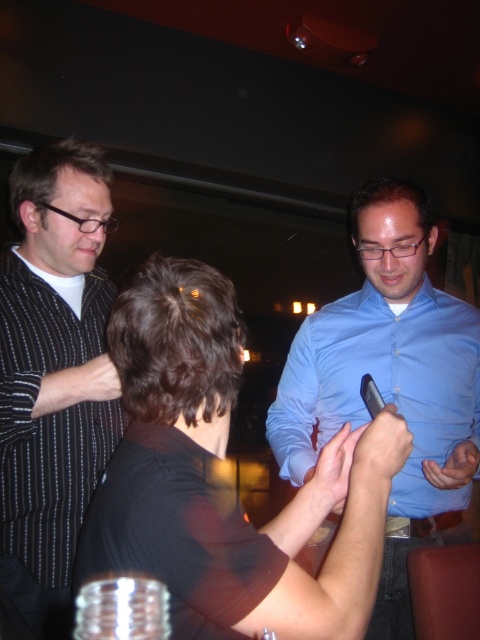
Looking at this image, you are at a bar and want to order a drink. The bartender is at the point labeled as point (214, 486). Where should you go to place your order?

You should go to the point labeled as point (214, 486) where the bartender is located to place your order.